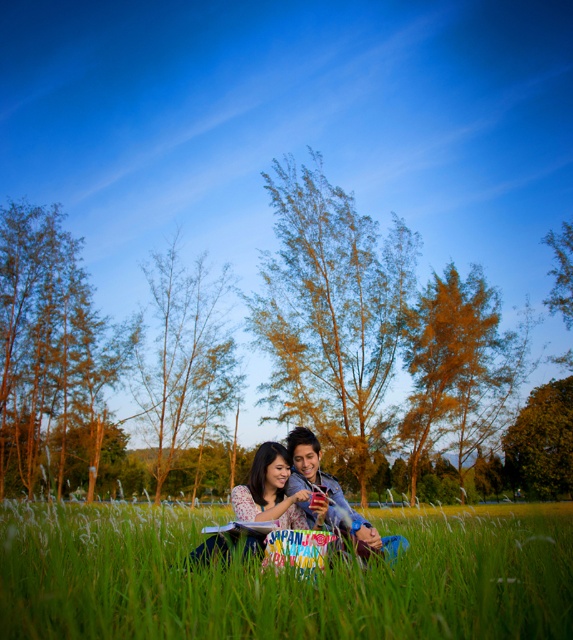
Does green soft grass at lower center come in front of matte plastic phone at center?

Yes, green soft grass at lower center is in front of matte plastic phone at center.

Identify the location of green soft grass at lower center. (281, 579).

Does point (119, 584) lie in front of point (312, 486)?

That is True.

Locate an element on the screen. green soft grass at lower center is located at coordinates (281, 579).